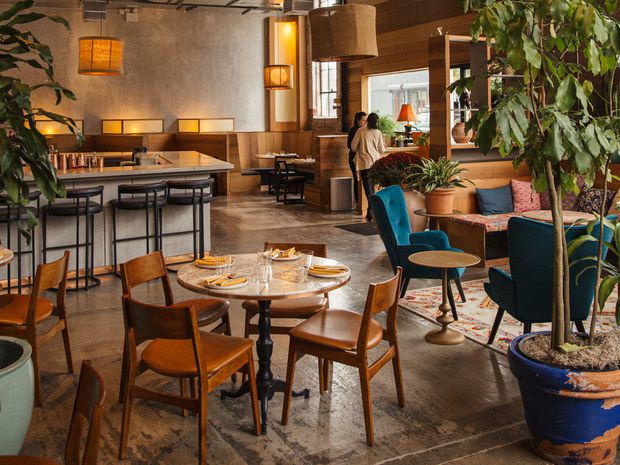
Identify the location of pots. (20, 387), (449, 193), (414, 202), (565, 387), (389, 137).